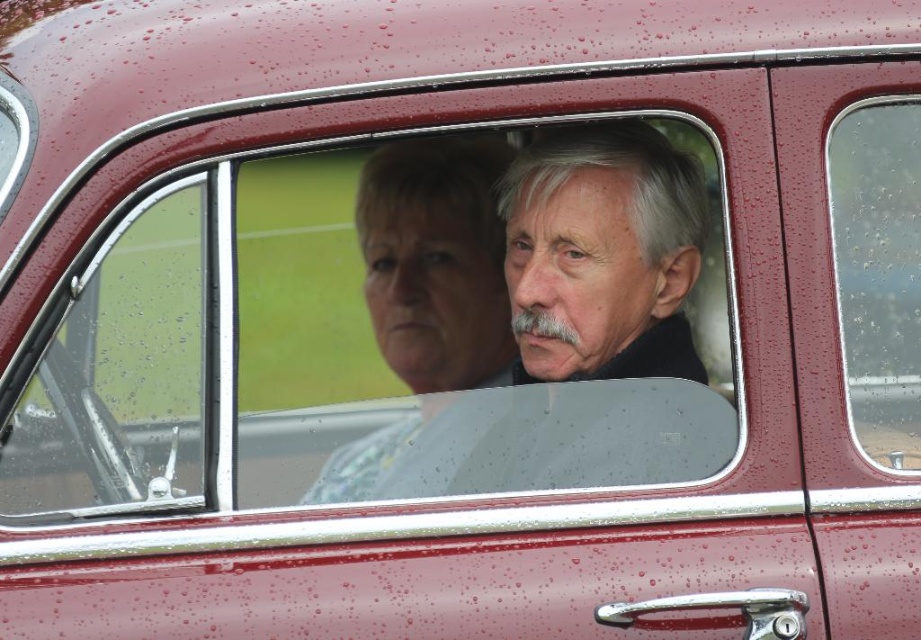
Does smooth gray jacket at center have a lesser height compared to transparent glass window at right?

Indeed, smooth gray jacket at center has a lesser height compared to transparent glass window at right.

Between smooth gray jacket at center and transparent glass window at right, which one is positioned higher?

transparent glass window at right

Between point (391, 236) and point (906, 209), which one is positioned behind?

The point (391, 236) is behind.

Locate an element on the screen. Image resolution: width=921 pixels, height=640 pixels. smooth gray jacket at center is located at coordinates (436, 260).

Consider the image. Between smooth gray hair at center and transparent glass window at right, which one is positioned higher?

transparent glass window at right is above.

You are a GUI agent. You are given a task and a screenshot of the screen. Output one action in this format:
    pyautogui.click(x=<x>, y=<y>)
    Task: Click on the smooth gray hair at center
    The image size is (921, 640).
    Given the screenshot: What is the action you would take?
    pyautogui.click(x=554, y=333)

Is point (653, 204) in front of point (845, 301)?

No, it is behind (845, 301).

In order to click on smooth gray hair at center in this screenshot , I will do `click(554, 333)`.

Is smooth gray hair at center to the left of smooth gray jacket at center from the viewer's perspective?

In fact, smooth gray hair at center is to the right of smooth gray jacket at center.

Locate an element on the screen. This screenshot has width=921, height=640. smooth gray hair at center is located at coordinates (554, 333).

Does point (599, 308) come closer to viewer compared to point (457, 356)?

No, (599, 308) is behind (457, 356).

The width and height of the screenshot is (921, 640). I want to click on smooth gray hair at center, so click(x=554, y=333).